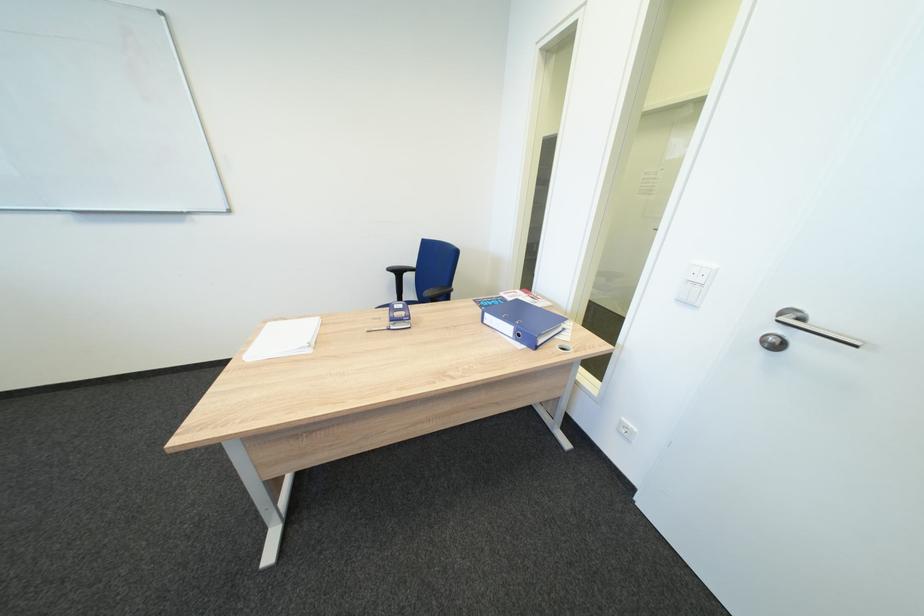
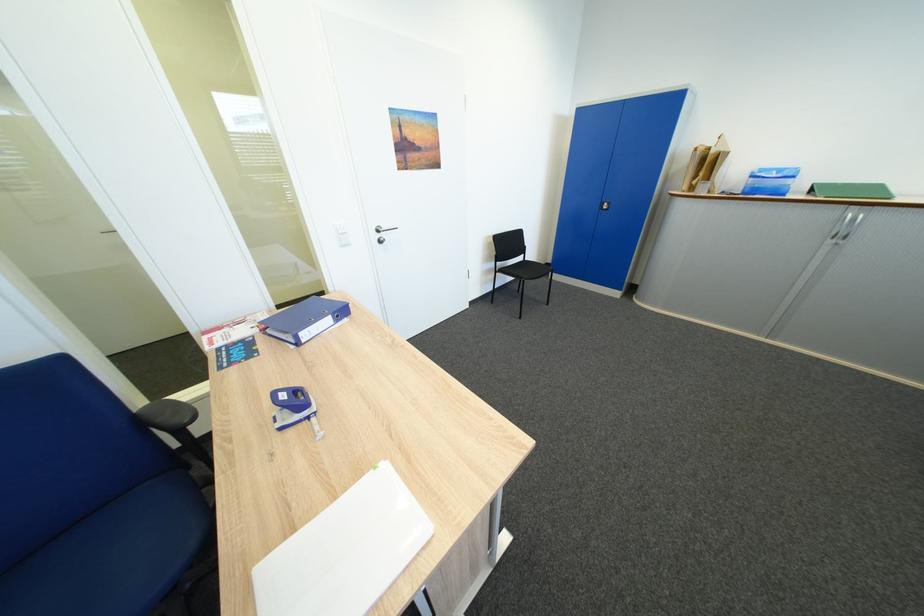
Where in the second image is the point corresponding to (496,315) from the first image?

(310, 334)